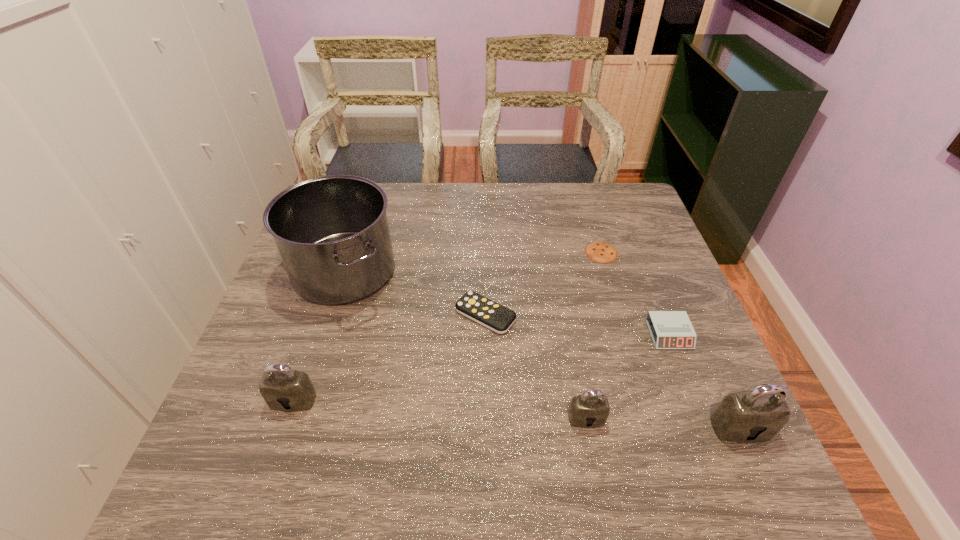
Where is `the second tallest padlock`? the second tallest padlock is located at coordinates (283, 389).

The image size is (960, 540). In order to click on the third tallest object in this screenshot , I will do `click(283, 389)`.

This screenshot has width=960, height=540. I want to click on the second padlock from right to left, so click(x=591, y=409).

At what (x,y) coordinates should I click in order to perform the action: click on the fourth object from left to right. Please return your answer as a coordinate pair (x, y). This screenshot has width=960, height=540. Looking at the image, I should click on (591, 409).

Where is `the tallest padlock`? This screenshot has height=540, width=960. the tallest padlock is located at coordinates (757, 415).

Locate an element on the screen. the rightmost padlock is located at coordinates (757, 415).

Locate an element on the screen. Image resolution: width=960 pixels, height=540 pixels. remote control is located at coordinates coord(498,318).

Where is `the fifth object from right to left`? The image size is (960, 540). the fifth object from right to left is located at coordinates (498, 318).

What are the coordinates of `the third object from right to left` in the screenshot? It's located at (602, 252).

You are a GUI agent. You are given a task and a screenshot of the screen. Output one action in this format:
    pyautogui.click(x=<x>, y=<y>)
    Task: Click on the shortest object
    The width and height of the screenshot is (960, 540).
    Given the screenshot: What is the action you would take?
    pyautogui.click(x=602, y=252)